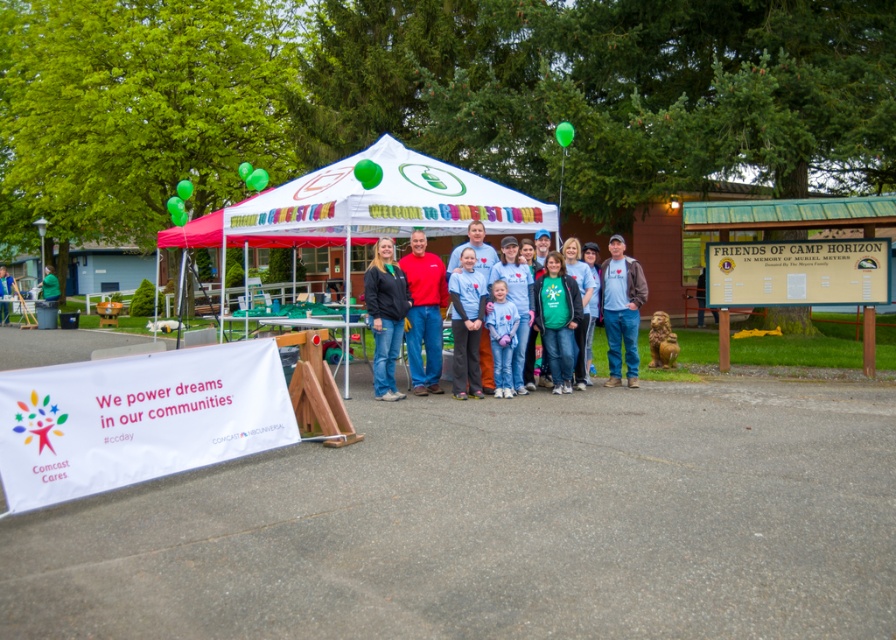
Does matte gray t-shirt at center lie in front of matte black jacket at center?

Yes.

Is matte gray t-shirt at center wider than matte black jacket at center?

In fact, matte gray t-shirt at center might be narrower than matte black jacket at center.

Who is more distant from viewer, (608, 273) or (11, 292)?

The point (11, 292) is more distant.

Identify the location of matte gray t-shirt at center. (621, 308).

What do you see at coordinates (365, 205) in the screenshot?
I see `white fabric canopy at center` at bounding box center [365, 205].

The width and height of the screenshot is (896, 640). I want to click on white fabric canopy at center, so click(x=365, y=205).

Who is more forward, (303, 205) or (476, 317)?

Result: Point (476, 317)

You are a GUI agent. You are given a task and a screenshot of the screen. Output one action in this format:
    pyautogui.click(x=<x>, y=<y>)
    Task: Click on the white fabric canopy at center
    
    Given the screenshot: What is the action you would take?
    pyautogui.click(x=365, y=205)

Between black matte jacket at center and matte black jacket at center, which one is positioned lower?

Positioned lower is black matte jacket at center.

Is black matte jacket at center to the left of matte black jacket at center from the viewer's perspective?

No, black matte jacket at center is not to the left of matte black jacket at center.

Image resolution: width=896 pixels, height=640 pixels. In order to click on black matte jacket at center in this screenshot , I will do `click(385, 314)`.